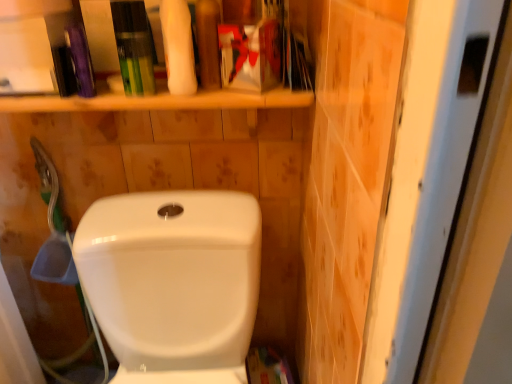
Question: Is white glossy toilet at center wider than matte plastic toothpaste tube at upper center, acting as the 2th toiletry starting from the left?

Choices:
 (A) yes
 (B) no

Answer: (A)

Question: Is white glossy toilet at center further to camera compared to matte plastic toothpaste tube at upper center, acting as the 2th toiletry starting from the left?

Choices:
 (A) no
 (B) yes

Answer: (A)

Question: Is white glossy toilet at center placed right next to matte plastic toothpaste tube at upper center, acting as the 2th toiletry starting from the left?

Choices:
 (A) no
 (B) yes

Answer: (A)

Question: Considering the relative sizes of white glossy toilet at center and matte plastic toothpaste tube at upper center, arranged as the first toiletry when viewed from the right, in the image provided, is white glossy toilet at center shorter than matte plastic toothpaste tube at upper center, arranged as the first toiletry when viewed from the right,?

Choices:
 (A) no
 (B) yes

Answer: (A)

Question: Can you confirm if white glossy toilet at center is taller than matte plastic toothpaste tube at upper center, acting as the 2th toiletry starting from the left?

Choices:
 (A) no
 (B) yes

Answer: (B)

Question: Is white glossy toilet at center aimed at matte plastic toothpaste tube at upper center, acting as the 2th toiletry starting from the left?

Choices:
 (A) yes
 (B) no

Answer: (B)

Question: Is green plastic tube at upper center, placed as the first toiletry when sorted from left to right, oriented away from white glossy toilet at center?

Choices:
 (A) yes
 (B) no

Answer: (B)

Question: From a real-world perspective, is green plastic tube at upper center, placed as the 2th toiletry when sorted from right to left, beneath white glossy toilet at center?

Choices:
 (A) no
 (B) yes

Answer: (A)

Question: From the image's perspective, is green plastic tube at upper center, placed as the 2th toiletry when sorted from right to left, above white glossy toilet at center?

Choices:
 (A) yes
 (B) no

Answer: (A)

Question: Can you see green plastic tube at upper center, placed as the 2th toiletry when sorted from right to left, touching white glossy toilet at center?

Choices:
 (A) no
 (B) yes

Answer: (A)

Question: Considering the relative sizes of green plastic tube at upper center, placed as the first toiletry when sorted from left to right, and white glossy toilet at center in the image provided, is green plastic tube at upper center, placed as the first toiletry when sorted from left to right, smaller than white glossy toilet at center?

Choices:
 (A) no
 (B) yes

Answer: (B)

Question: Does green plastic tube at upper center, placed as the 2th toiletry when sorted from right to left, have a greater height compared to white glossy toilet at center?

Choices:
 (A) no
 (B) yes

Answer: (A)

Question: From the image's perspective, does white matte sponge at upper center appear lower than matte plastic toothpaste tube at upper center, acting as the 2th toiletry starting from the left?

Choices:
 (A) yes
 (B) no

Answer: (A)